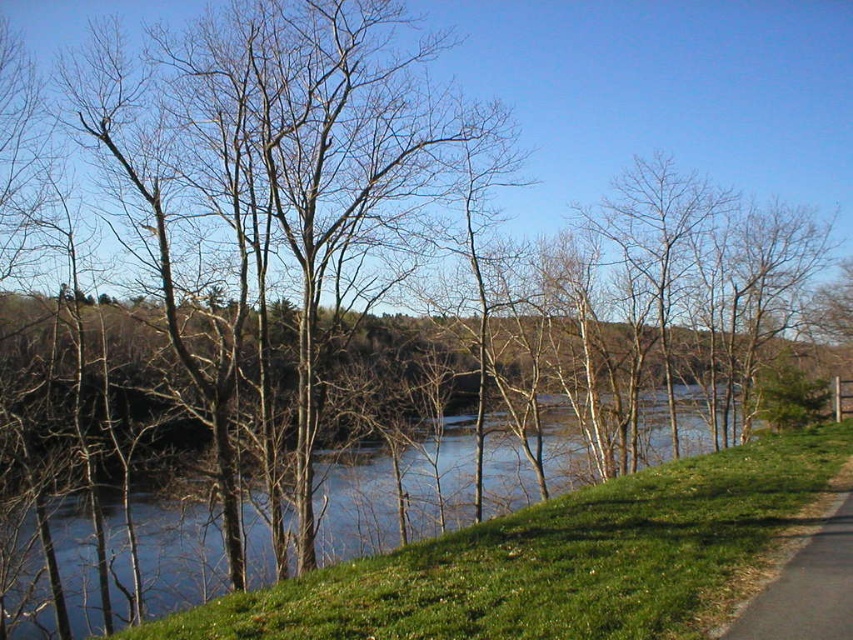
You are standing at the point with coordinates (177, 556) in this landscape. What do you see directly beneath your feet?

At point (177, 556) lies blue water at center.

You are standing at the starting point of the black asphalt path at lower right and want to reach the blue water at center. Which direction should you head towards?

The blue water at center is positioned on the right side of the black asphalt path at lower right, so you should head towards the right direction from the path to reach it.